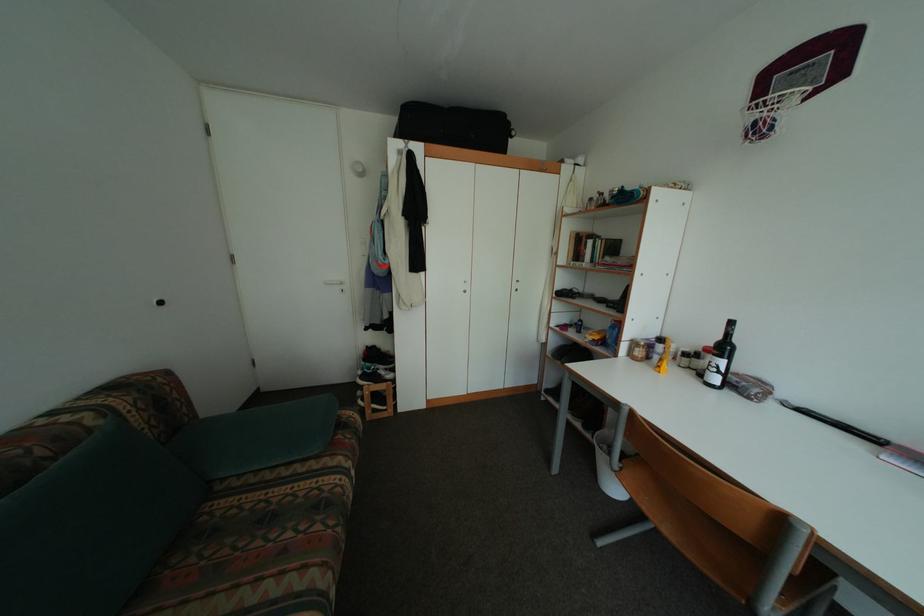
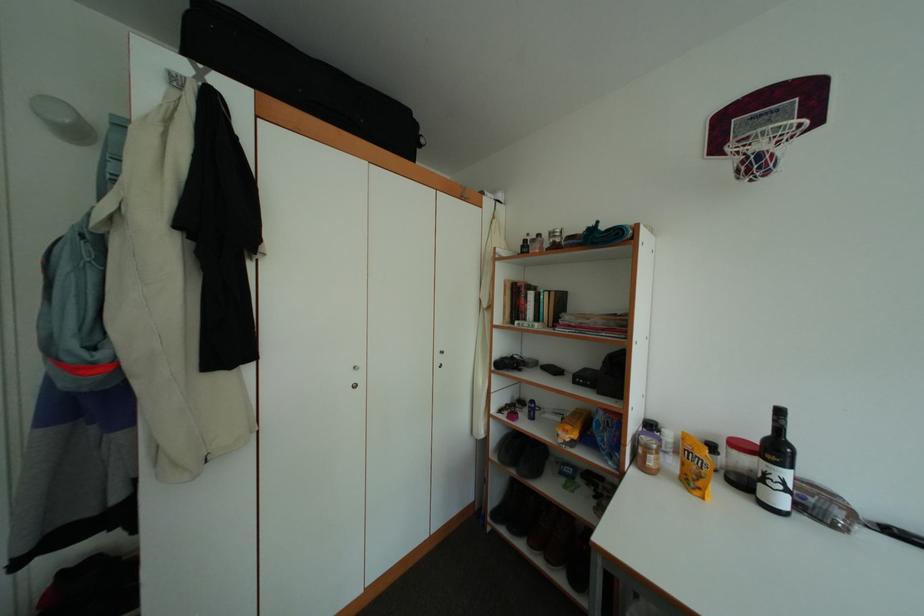
Question: In a continuous first-person perspective shot, in which direction is the camera moving?

Choices:
 (A) Left
 (B) Right
 (C) Forward
 (D) Backward

Answer: (C)